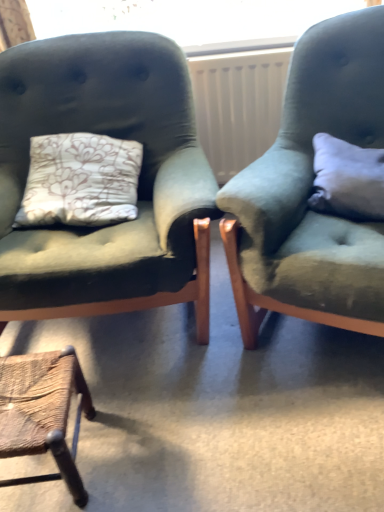
Question: Is white plastic radiator at center not near velvet green armchair at left, which is counted as the second chair, starting from the left?

Choices:
 (A) yes
 (B) no

Answer: (B)

Question: Does white plastic radiator at center have a greater height compared to velvet green armchair at left, placed as the second chair when sorted from right to left?

Choices:
 (A) yes
 (B) no

Answer: (B)

Question: Considering the relative positions of white plastic radiator at center and velvet green armchair at left, placed as the second chair when sorted from right to left, in the image provided, is white plastic radiator at center to the right of velvet green armchair at left, placed as the second chair when sorted from right to left, from the viewer's perspective?

Choices:
 (A) yes
 (B) no

Answer: (A)

Question: Is white plastic radiator at center touching velvet green armchair at left, which is counted as the second chair, starting from the left?

Choices:
 (A) yes
 (B) no

Answer: (B)

Question: From the image's perspective, is white plastic radiator at center over velvet green armchair at left, placed as the second chair when sorted from right to left?

Choices:
 (A) yes
 (B) no

Answer: (A)

Question: Is point (104, 101) closer or farther from the camera than point (0, 424)?

Choices:
 (A) farther
 (B) closer

Answer: (A)

Question: Is velvet green armchair at left, which is counted as the second chair, starting from the left, bigger or smaller than rustic wood stool at lower left, the 1th chair in the left-to-right sequence?

Choices:
 (A) small
 (B) big

Answer: (B)

Question: From the image's perspective, is velvet green armchair at left, placed as the second chair when sorted from right to left, positioned above or below rustic wood stool at lower left, the 1th chair in the left-to-right sequence?

Choices:
 (A) above
 (B) below

Answer: (A)

Question: In the image, is velvet green armchair at left, placed as the second chair when sorted from right to left, on the left side or the right side of rustic wood stool at lower left, the third chair in the right-to-left sequence?

Choices:
 (A) right
 (B) left

Answer: (A)

Question: From a real-world perspective, is white soft pillow at right positioned above or below rustic wood stool at lower left, the 1th chair in the left-to-right sequence?

Choices:
 (A) below
 (B) above

Answer: (B)

Question: Is white soft pillow at right to the left or to the right of rustic wood stool at lower left, the third chair in the right-to-left sequence, in the image?

Choices:
 (A) left
 (B) right

Answer: (B)

Question: Looking at the image, does white soft pillow at right seem bigger or smaller compared to rustic wood stool at lower left, the third chair in the right-to-left sequence?

Choices:
 (A) small
 (B) big

Answer: (A)

Question: In terms of width, does white soft pillow at right look wider or thinner when compared to rustic wood stool at lower left, the third chair in the right-to-left sequence?

Choices:
 (A) thin
 (B) wide

Answer: (A)

Question: From the image's perspective, is white plastic radiator at center located above or below velvet green armchair at right, marked as the third chair in a left-to-right arrangement?

Choices:
 (A) above
 (B) below

Answer: (A)

Question: Choose the correct answer: Is white plastic radiator at center inside velvet green armchair at right, marked as the third chair in a left-to-right arrangement, or outside it?

Choices:
 (A) outside
 (B) inside

Answer: (A)